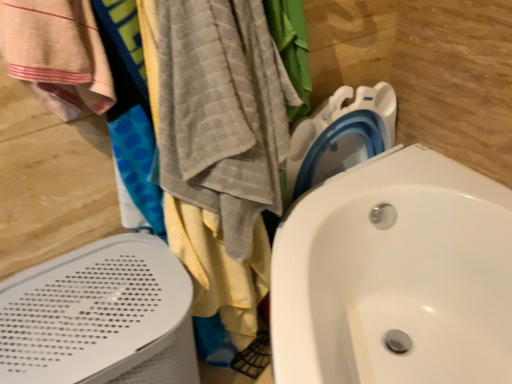
Question: Should I look upward or downward to see gray textured towel at left, acting as the 2th beach towel starting from the left?

Choices:
 (A) down
 (B) up

Answer: (B)

Question: From the image's perspective, is gray textured towel at left, acting as the 2th beach towel starting from the left, under white perforated bath heater at left?

Choices:
 (A) no
 (B) yes

Answer: (A)

Question: Does gray textured towel at left, acting as the 2th beach towel starting from the left, appear on the right side of white perforated bath heater at left?

Choices:
 (A) no
 (B) yes

Answer: (B)

Question: Is the surface of gray textured towel at left, which is the first beach towel in right-to-left order, in direct contact with white perforated bath heater at left?

Choices:
 (A) no
 (B) yes

Answer: (A)

Question: Can you confirm if gray textured towel at left, acting as the 2th beach towel starting from the left, is taller than white perforated bath heater at left?

Choices:
 (A) no
 (B) yes

Answer: (A)

Question: Is the depth of gray textured towel at left, acting as the 2th beach towel starting from the left, less than that of white perforated bath heater at left?

Choices:
 (A) yes
 (B) no

Answer: (A)

Question: Are gray textured towel at left, acting as the 2th beach towel starting from the left, and white perforated bath heater at left located far from each other?

Choices:
 (A) no
 (B) yes

Answer: (A)

Question: Does beige woven towel at left, which is the 2th beach towel from right to left, have a larger size compared to white glossy sink at center?

Choices:
 (A) no
 (B) yes

Answer: (A)

Question: Does beige woven towel at left, which is the 2th beach towel from right to left, appear on the left side of white glossy sink at center?

Choices:
 (A) yes
 (B) no

Answer: (A)

Question: Is beige woven towel at left, which is the 2th beach towel from right to left, not within white glossy sink at center?

Choices:
 (A) no
 (B) yes

Answer: (B)

Question: Is beige woven towel at left, positioned as the first beach towel in left-to-right order, thinner than white glossy sink at center?

Choices:
 (A) no
 (B) yes

Answer: (B)

Question: From a real-world perspective, does beige woven towel at left, positioned as the first beach towel in left-to-right order, stand above white glossy sink at center?

Choices:
 (A) yes
 (B) no

Answer: (A)

Question: Is beige woven towel at left, which is the 2th beach towel from right to left, taller than white glossy sink at center?

Choices:
 (A) no
 (B) yes

Answer: (A)

Question: Can you confirm if white glossy sink at center is bigger than gray textured towel at left, acting as the 2th beach towel starting from the left?

Choices:
 (A) yes
 (B) no

Answer: (A)